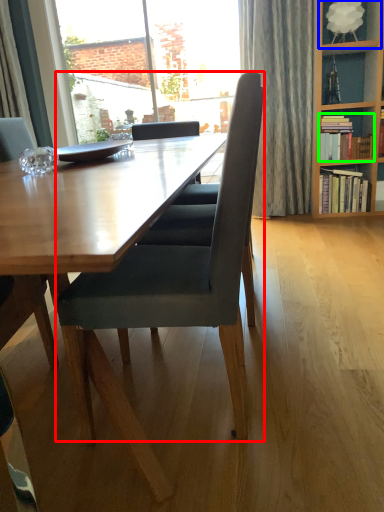
Question: Which object is the closest to the chair (highlighted by a red box)? Choose among these: shelf (highlighted by a blue box) or book (highlighted by a green box).

Choices:
 (A) shelf
 (B) book

Answer: (B)